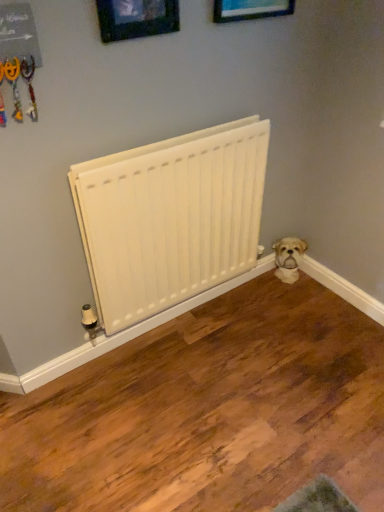
Question: Does wooden picture frame at upper center, the 1th picture frame in the left-to-right sequence, have a smaller size compared to wooden picture frame at upper center, arranged as the 2th picture frame when viewed from the left?

Choices:
 (A) yes
 (B) no

Answer: (A)

Question: Is wooden picture frame at upper center, which appears as the 2th picture frame when viewed from the right, turned away from wooden picture frame at upper center, arranged as the 2th picture frame when viewed from the left?

Choices:
 (A) no
 (B) yes

Answer: (A)

Question: Is there a large distance between wooden picture frame at upper center, which appears as the 2th picture frame when viewed from the right, and wooden picture frame at upper center, arranged as the 2th picture frame when viewed from the left?

Choices:
 (A) no
 (B) yes

Answer: (A)

Question: Does wooden picture frame at upper center, the 1th picture frame in the left-to-right sequence, turn towards wooden picture frame at upper center, which is the 1th picture frame from right to left?

Choices:
 (A) yes
 (B) no

Answer: (B)

Question: From the image's perspective, would you say wooden picture frame at upper center, which appears as the 2th picture frame when viewed from the right, is positioned over wooden picture frame at upper center, which is the 1th picture frame from right to left?

Choices:
 (A) yes
 (B) no

Answer: (B)

Question: Looking at the image, does wooden picture frame at upper center, which is the 1th picture frame from right to left, seem bigger or smaller compared to white matte radiator at center?

Choices:
 (A) small
 (B) big

Answer: (A)

Question: Does point (251, 5) appear closer or farther from the camera than point (190, 268)?

Choices:
 (A) closer
 (B) farther

Answer: (A)

Question: Based on their positions, is wooden picture frame at upper center, arranged as the 2th picture frame when viewed from the left, located to the left or right of white matte radiator at center?

Choices:
 (A) right
 (B) left

Answer: (A)

Question: Considering the positions of wooden picture frame at upper center, arranged as the 2th picture frame when viewed from the left, and white matte radiator at center in the image, is wooden picture frame at upper center, arranged as the 2th picture frame when viewed from the left, taller or shorter than white matte radiator at center?

Choices:
 (A) tall
 (B) short

Answer: (B)

Question: In terms of width, does white fluffy dog at lower right look wider or thinner when compared to wooden picture frame at upper center, which appears as the 2th picture frame when viewed from the right?

Choices:
 (A) wide
 (B) thin

Answer: (A)

Question: From a real-world perspective, relative to wooden picture frame at upper center, the 1th picture frame in the left-to-right sequence, is white fluffy dog at lower right vertically above or below?

Choices:
 (A) below
 (B) above

Answer: (A)

Question: Which is correct: white fluffy dog at lower right is inside wooden picture frame at upper center, the 1th picture frame in the left-to-right sequence, or outside of it?

Choices:
 (A) inside
 (B) outside

Answer: (B)

Question: In terms of size, does white fluffy dog at lower right appear bigger or smaller than wooden picture frame at upper center, the 1th picture frame in the left-to-right sequence?

Choices:
 (A) big
 (B) small

Answer: (A)

Question: Is wooden picture frame at upper center, which appears as the 2th picture frame when viewed from the right, situated inside white matte radiator at center or outside?

Choices:
 (A) outside
 (B) inside

Answer: (A)

Question: Is wooden picture frame at upper center, the 1th picture frame in the left-to-right sequence, wider or thinner than white matte radiator at center?

Choices:
 (A) wide
 (B) thin

Answer: (B)